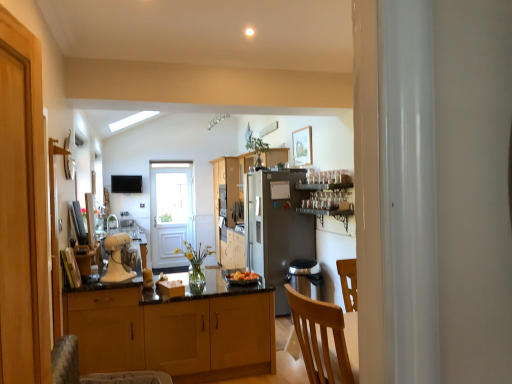
Question: Which direction should I rotate to face matte white cabinet at center, the 3th cabinetry when ordered from back to front, — up or down?

Choices:
 (A) up
 (B) down

Answer: (B)

Question: Does wooden cabinets at center, the 3th cabinetry from the front, have a greater height compared to smooth orange fruit at center?

Choices:
 (A) yes
 (B) no

Answer: (A)

Question: Can you confirm if wooden cabinets at center, marked as the first cabinetry in a back-to-front arrangement, is smaller than smooth orange fruit at center?

Choices:
 (A) no
 (B) yes

Answer: (A)

Question: From the image's perspective, is wooden cabinets at center, the 3th cabinetry from the front, on top of smooth orange fruit at center?

Choices:
 (A) no
 (B) yes

Answer: (B)

Question: Considering the relative positions of wooden cabinets at center, the 3th cabinetry from the front, and smooth orange fruit at center in the image provided, is wooden cabinets at center, the 3th cabinetry from the front, to the right of smooth orange fruit at center from the viewer's perspective?

Choices:
 (A) yes
 (B) no

Answer: (B)

Question: Is wooden cabinets at center, the 3th cabinetry from the front, positioned behind smooth orange fruit at center?

Choices:
 (A) no
 (B) yes

Answer: (B)

Question: Is wooden cabinets at center, the 3th cabinetry from the front, shorter than smooth orange fruit at center?

Choices:
 (A) no
 (B) yes

Answer: (A)

Question: Can you confirm if wooden cabinet at center, arranged as the second cabinetry when viewed from the front, is wider than matte black tv at upper center?

Choices:
 (A) no
 (B) yes

Answer: (B)

Question: Considering the relative sizes of wooden cabinet at center, arranged as the second cabinetry when viewed from the front, and matte black tv at upper center in the image provided, is wooden cabinet at center, arranged as the second cabinetry when viewed from the front, shorter than matte black tv at upper center?

Choices:
 (A) yes
 (B) no

Answer: (B)

Question: Does wooden cabinet at center, positioned as the second cabinetry in back-to-front order, appear on the right side of matte black tv at upper center?

Choices:
 (A) no
 (B) yes

Answer: (B)

Question: Is wooden cabinet at center, positioned as the second cabinetry in back-to-front order, taller than matte black tv at upper center?

Choices:
 (A) no
 (B) yes

Answer: (B)

Question: From a real-world perspective, is wooden cabinet at center, positioned as the second cabinetry in back-to-front order, located higher than matte black tv at upper center?

Choices:
 (A) no
 (B) yes

Answer: (A)

Question: Does wooden cabinet at center, positioned as the second cabinetry in back-to-front order, come in front of matte black tv at upper center?

Choices:
 (A) yes
 (B) no

Answer: (A)

Question: From a real-world perspective, is white glossy door at center beneath satin silver refrigerator at center?

Choices:
 (A) no
 (B) yes

Answer: (A)